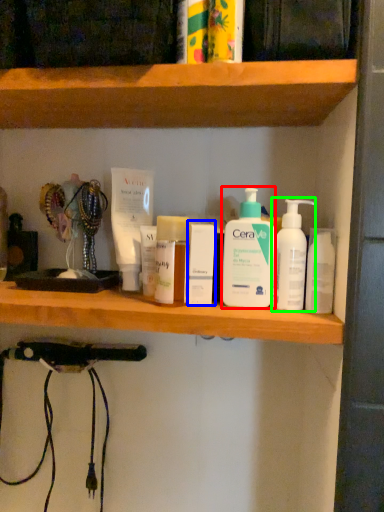
Question: Considering the real-world distances, which object is farthest from cleaning product (highlighted by a red box)? toiletry (highlighted by a blue box) or cleaning product (highlighted by a green box)?

Choices:
 (A) toiletry
 (B) cleaning product

Answer: (A)